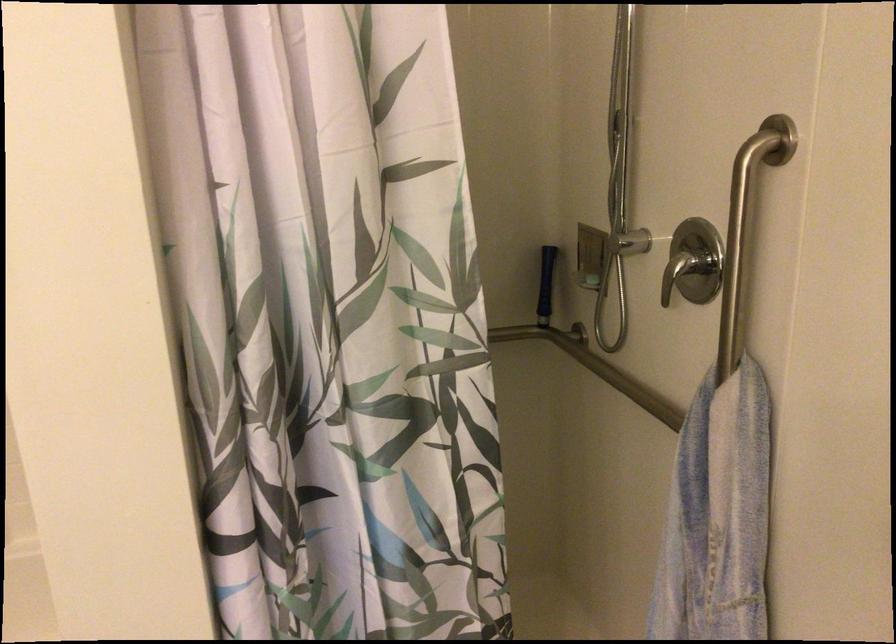
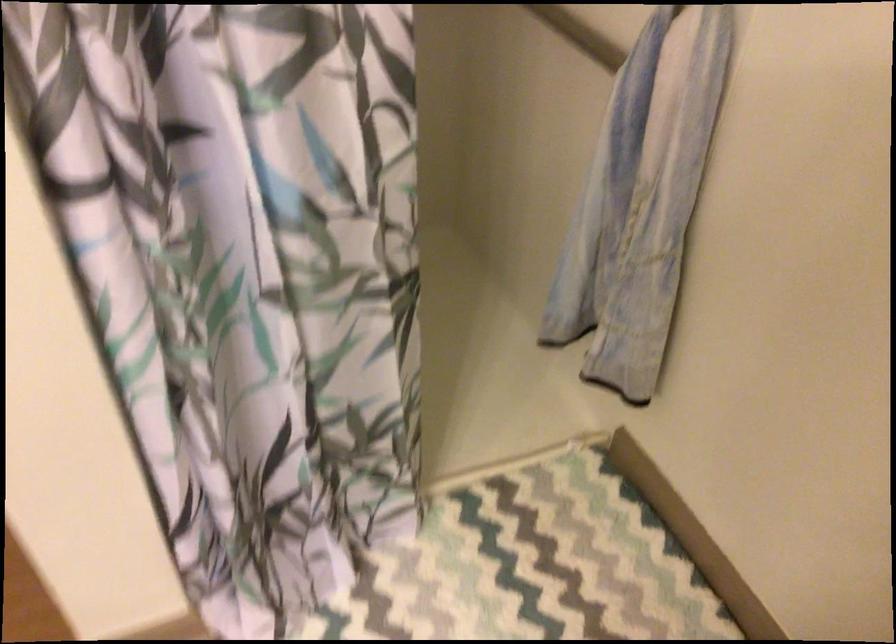
Question: In a continuous first-person perspective shot, in which direction is the camera moving?

Choices:
 (A) Left
 (B) Right
 (C) Forward
 (D) Backward

Answer: (C)